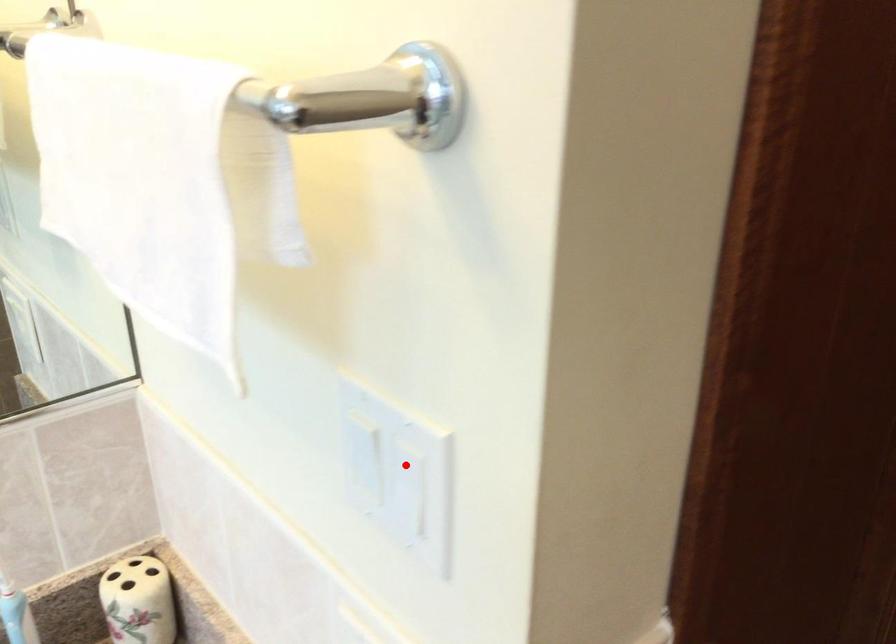
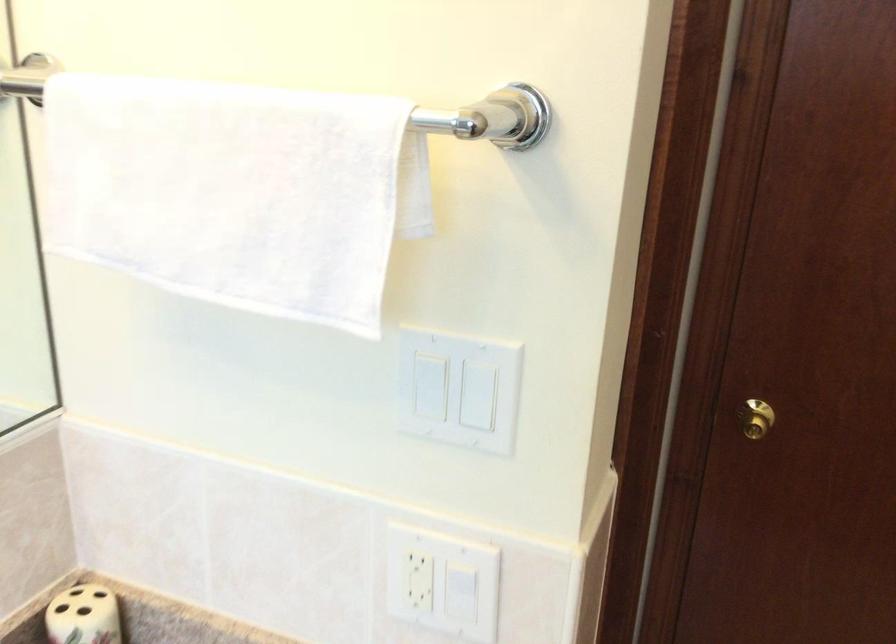
Question: I am providing you with two images of the same scene from different viewpoints. A red point is shown in image1. For the corresponding object point in image2, is it positioned nearer or farther from the camera?

Choices:
 (A) Nearer
 (B) Farther

Answer: (B)